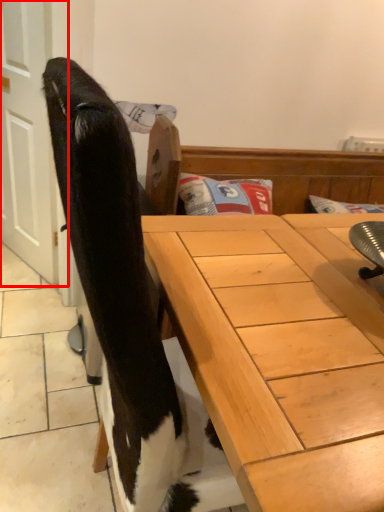
Question: From the image's perspective, considering the relative positions of screen door (annotated by the red box) and desk in the image provided, where is screen door (annotated by the red box) located with respect to the staircase?

Choices:
 (A) below
 (B) above

Answer: (B)